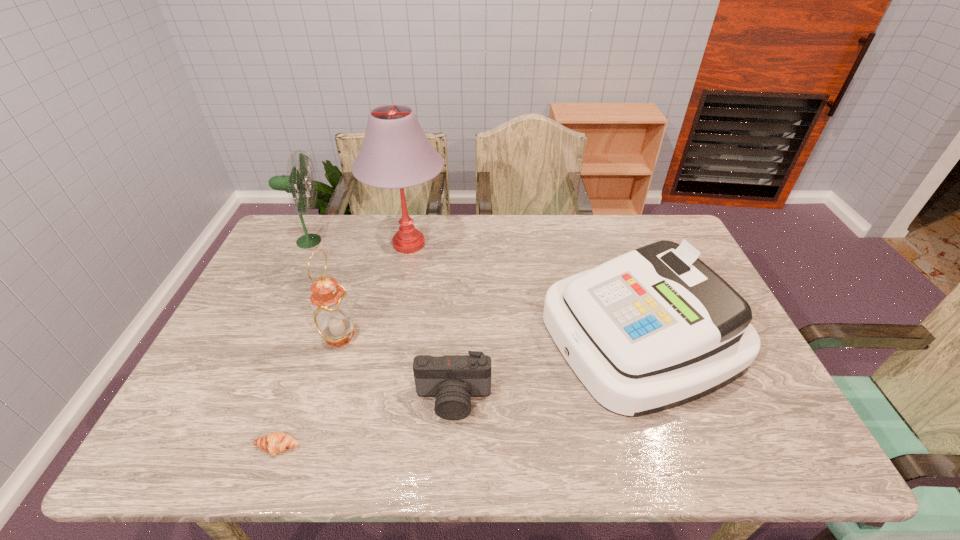
Find the location of `free space that is in between the fan and the shortest object`. free space that is in between the fan and the shortest object is located at coordinates (293, 344).

Identify the location of vacant space that's between the leftmost object and the table lamp. Image resolution: width=960 pixels, height=540 pixels. (358, 242).

At what (x,y) coordinates should I click in order to perform the action: click on the third closest object to the nearest object. Please return your answer as a coordinate pair (x, y). The width and height of the screenshot is (960, 540). Looking at the image, I should click on (395, 154).

Identify which object is the third nearest to the camera. Please provide its 2D coordinates. Your answer should be formatted as a tuple, i.e. [(x, y)], where the tuple contains the x and y coordinates of a point satisfying the conditions above.

[(276, 442)]

Find the location of a particular element. The width and height of the screenshot is (960, 540). free location that satisfies the following two spatial constraints: 1. on the front-facing side of the tallest object; 2. on the front-facing side of the shortest object is located at coordinates (370, 447).

The width and height of the screenshot is (960, 540). Identify the location of free space that satisfies the following two spatial constraints: 1. on the back side of the rightmost object; 2. on the front-facing side of the tallest object. (609, 244).

Locate an element on the screen. This screenshot has width=960, height=540. vacant point that satisfies the following two spatial constraints: 1. on the front-facing side of the tallest object; 2. on the left side of the cash register is located at coordinates (391, 335).